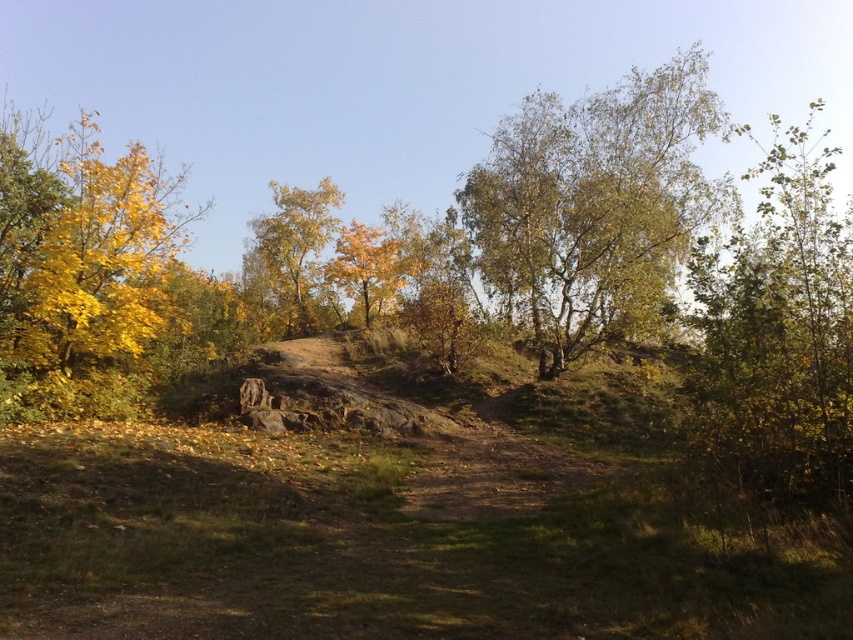
Does green leafy tree at right lie in front of golden textured tree at center?

That is True.

Find the location of a particular element. The width and height of the screenshot is (853, 640). green leafy tree at right is located at coordinates (779, 333).

Is green leafy tree at right bigger than yellow matte tree at center?

Yes.

Is green leafy tree at right to the left of yellow matte tree at center from the viewer's perspective?

Incorrect, green leafy tree at right is not on the left side of yellow matte tree at center.

Who is more distant from viewer, (790,376) or (402,280)?

The point (402,280) is behind.

This screenshot has width=853, height=640. What are the coordinates of `green leafy tree at right` in the screenshot? It's located at (779, 333).

Consider the image. Between green leafy tree at center and golden textured tree at center, which one appears on the left side from the viewer's perspective?

golden textured tree at center

Describe the element at coordinates (595, 204) in the screenshot. I see `green leafy tree at center` at that location.

What do you see at coordinates (595, 204) in the screenshot? I see `green leafy tree at center` at bounding box center [595, 204].

The width and height of the screenshot is (853, 640). Find the location of `green leafy tree at center`. green leafy tree at center is located at coordinates (595, 204).